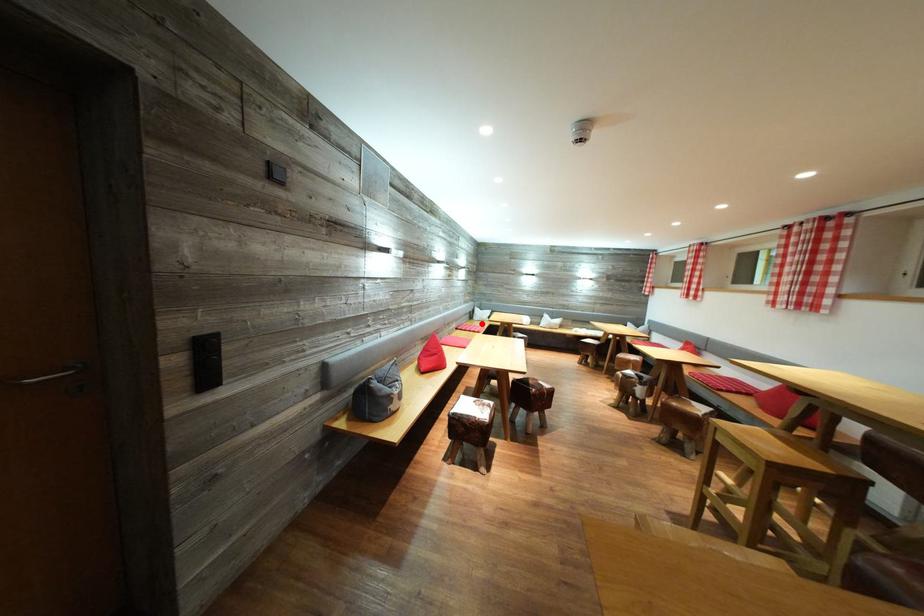
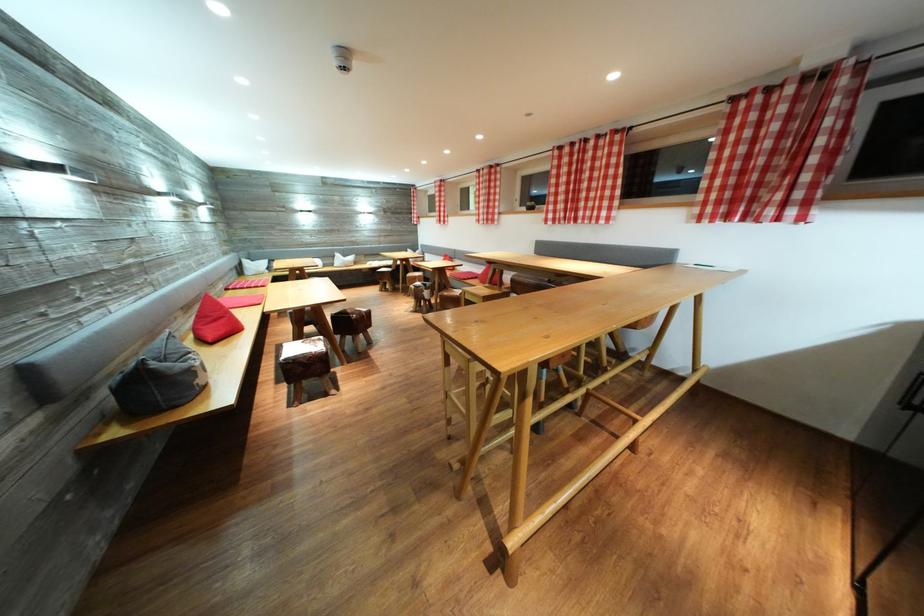
Where in the second image is the point corresponding to the highlighted location from the first image?

(254, 278)